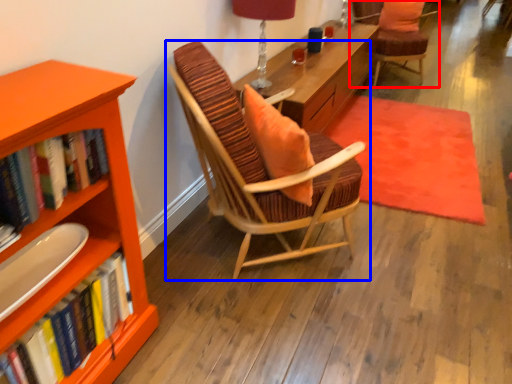
Question: Which object appears farthest to the camera in this image, chair (highlighted by a red box) or chair (highlighted by a blue box)?

Choices:
 (A) chair
 (B) chair

Answer: (A)